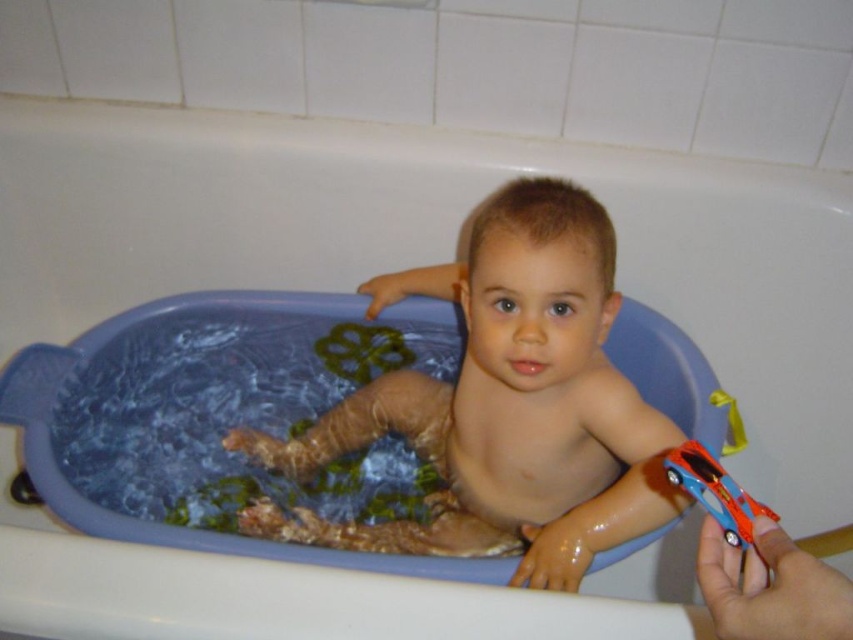
Based on the scene description, where exactly is the smooth skin child at center located in the image?

The smooth skin child at center is located at point coordinates of 0.633 on the x axis and 0.593 on the y axis.

You are a parent trying to choose a toy for your child. The child is sitting in the bath tub and you see the smooth skin child at center and the shiny plastic car at lower right. Which object is wider?

The smooth skin child at center is wider than the shiny plastic car at lower right.